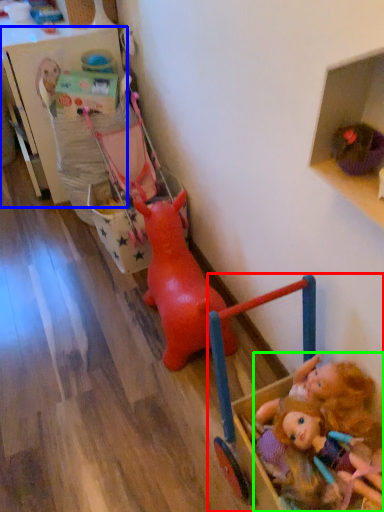
Question: Considering the real-world distances, which object is farthest from toy (highlighted by a red box)? shelf (highlighted by a blue box) or person (highlighted by a green box)?

Choices:
 (A) shelf
 (B) person

Answer: (A)